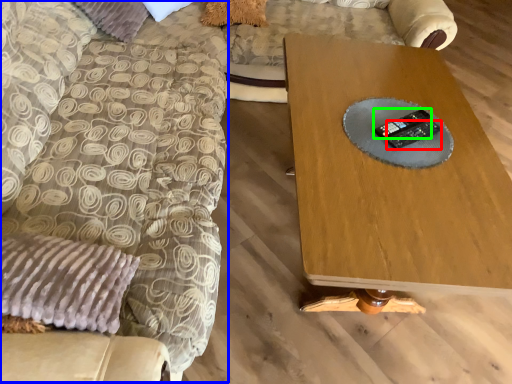
Question: Which is nearer to the control (highlighted by a red box)? swivel chair (highlighted by a blue box) or control (highlighted by a green box).

Choices:
 (A) swivel chair
 (B) control

Answer: (B)